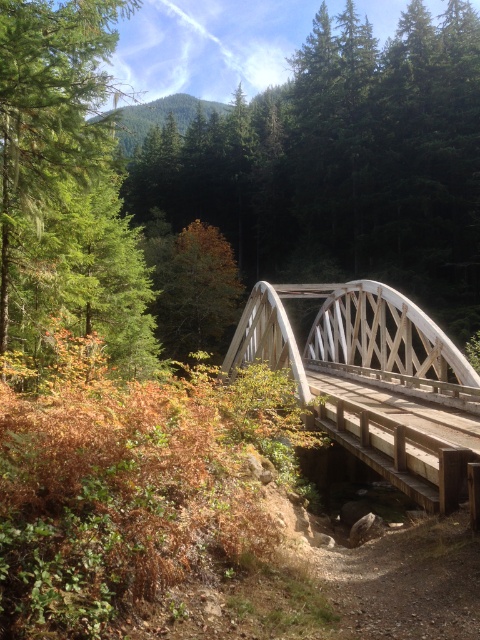
You are standing at the point marked as point (66, 186) in the forest scene. What object is located at that exact point?

The green matte tree at upper left is located at point (66, 186).

You are a hiker who wants to take a photo of the green matte tree at upper left and the white wooden bridge at center in the same frame. Can you stand at a distance where both are visible without moving your camera? Explain using their distance apart.

The green matte tree at upper left and white wooden bridge at center are 25.67 feet apart. Since the distance between them is 25.67 feet, a standard camera lens can likely capture both in the same frame if you position yourself at a suitable distance where the field of view encompasses both objects.

You are a painter setting up your easel to capture the forest scene. You want to ensure the green matte tree at upper left and the white wooden bridge at center are both clearly visible in your painting. Based on their sizes, which object should you position closer to the center of your canvas to maintain balance?

The green matte tree at upper left has a lesser width compared to the white wooden bridge at center. To balance the composition, position the smaller green matte tree at upper left closer to the center of the canvas so it appears more prominent, while placing the wider white wooden bridge at center slightly farther out to maintain visual equilibrium.